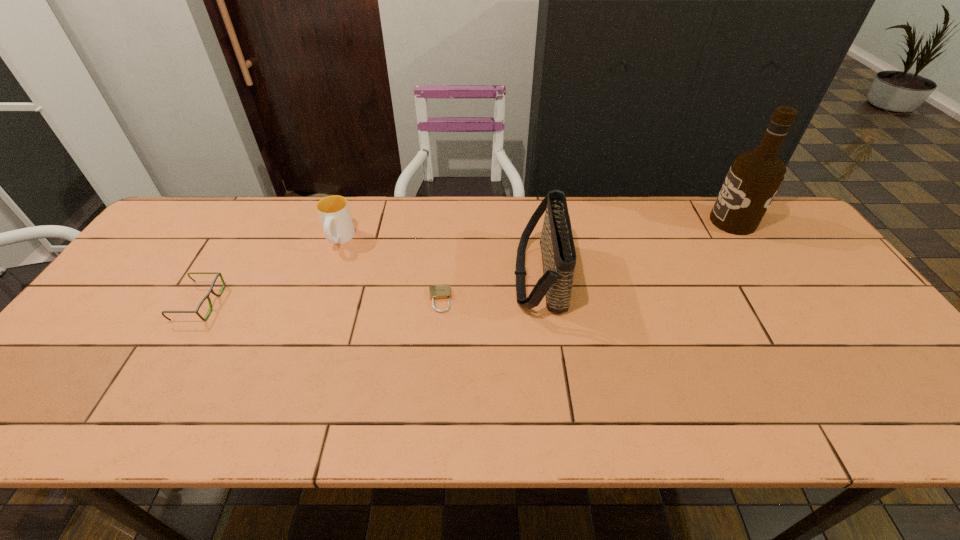
At what (x,y) coordinates should I click in order to perform the action: click on free space located 0.170m on the label of the tallest object. Please return your answer as a coordinate pair (x, y). The image size is (960, 540). Looking at the image, I should click on (658, 221).

Image resolution: width=960 pixels, height=540 pixels. Identify the location of free space located on the label of the tallest object. pos(689,221).

I want to click on vacant point located 0.060m on the label of the tallest object, so click(x=692, y=221).

Find the location of a particular element. Image resolution: width=960 pixels, height=540 pixels. free spot located on the back of the fourth shortest object is located at coordinates (529, 197).

Where is `vacant area situated 0.130m with the handle on the side of the cup`? This screenshot has height=540, width=960. vacant area situated 0.130m with the handle on the side of the cup is located at coordinates (323, 287).

Locate an element on the screen. The height and width of the screenshot is (540, 960). vacant space located 0.080m on the lens of the second shortest object is located at coordinates (247, 303).

Image resolution: width=960 pixels, height=540 pixels. Identify the location of vacant region located 0.220m on the left of the third object from left to right. (345, 300).

Image resolution: width=960 pixels, height=540 pixels. What are the coordinates of `alcohol that is positioned at the far edge` in the screenshot? It's located at (754, 178).

Locate an element on the screen. handbag present at the far edge is located at coordinates (558, 252).

Where is `cup positioned at the far edge`? cup positioned at the far edge is located at coordinates (334, 213).